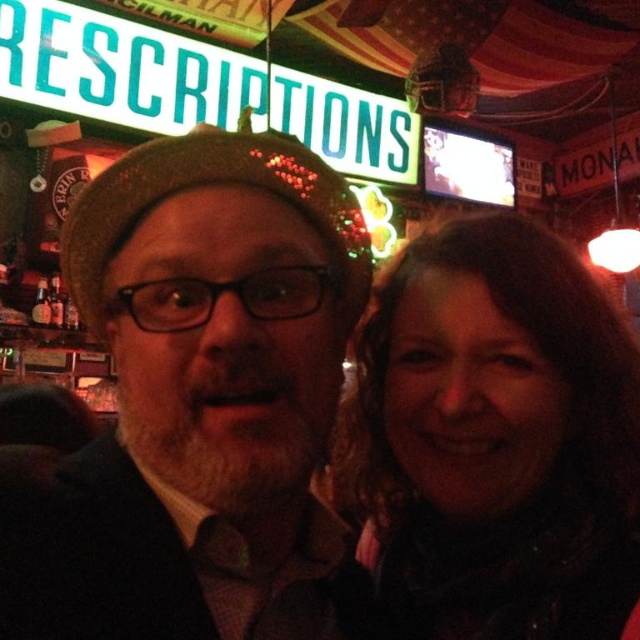
Is the position of dark brown knit hat at center less distant than that of dark brown hair at upper right?

That is True.

Locate an element on the screen. The image size is (640, 640). dark brown knit hat at center is located at coordinates (202, 400).